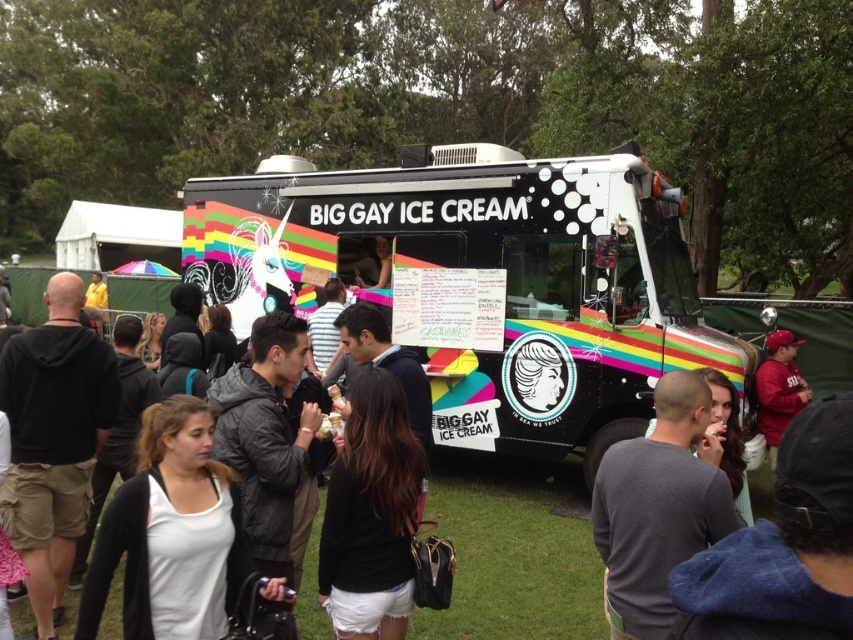
Question: In this image, where is rainbow painted ice cream truck at center located relative to matte black jacket at center?

Choices:
 (A) above
 (B) below

Answer: (A)

Question: Can you confirm if rainbow painted ice cream truck at center is positioned below matte black jacket at center?

Choices:
 (A) no
 (B) yes

Answer: (A)

Question: Which point is farther from the camera taking this photo?

Choices:
 (A) (422, 636)
 (B) (376, 177)

Answer: (B)

Question: Can you confirm if rainbow painted ice cream truck at center is thinner than matte black jacket at center?

Choices:
 (A) no
 (B) yes

Answer: (B)